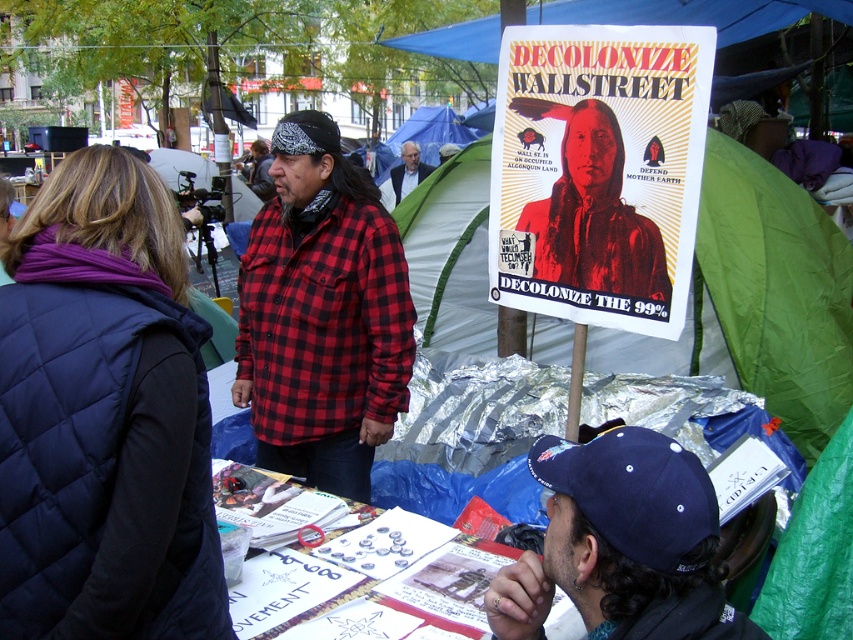
Who is shorter, dark blue fabric baseball cap at lower center or blue fabric canopy at upper center?

Standing shorter between the two is dark blue fabric baseball cap at lower center.

Is dark blue fabric baseball cap at lower center below blue fabric canopy at upper center?

Indeed, dark blue fabric baseball cap at lower center is positioned under blue fabric canopy at upper center.

From the picture: Measure the distance between dark blue fabric baseball cap at lower center and camera.

dark blue fabric baseball cap at lower center and camera are 3.50 feet apart.

Find the location of a particular element. dark blue fabric baseball cap at lower center is located at coordinates (634, 492).

Does dark blue quilted vest at left lie behind white paper poster at center?

No, it is not.

Is dark blue quilted vest at left to the right of white paper poster at center from the viewer's perspective?

No, dark blue quilted vest at left is not to the right of white paper poster at center.

Is point (0, 324) positioned behind point (689, 51)?

That is False.

Identify the location of dark blue quilted vest at left. The width and height of the screenshot is (853, 640). (103, 417).

Between white paper poster at center and blue fabric canopy at upper center, which one is positioned lower?

white paper poster at center is below.

Is point (532, 200) farther from viewer compared to point (469, 26)?

No, (532, 200) is in front of (469, 26).

Where is `white paper poster at center`? white paper poster at center is located at coordinates (598, 172).